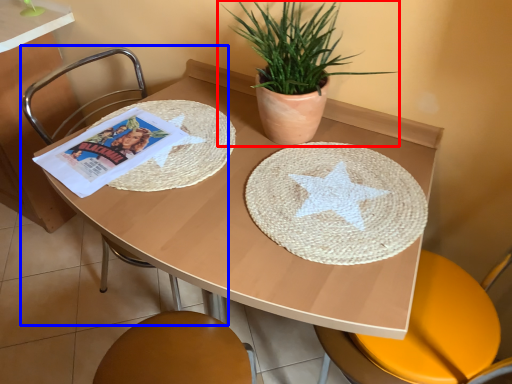
Question: Which object appears farthest to the camera in this image, houseplant (highlighted by a red box) or chair (highlighted by a blue box)?

Choices:
 (A) houseplant
 (B) chair

Answer: (B)